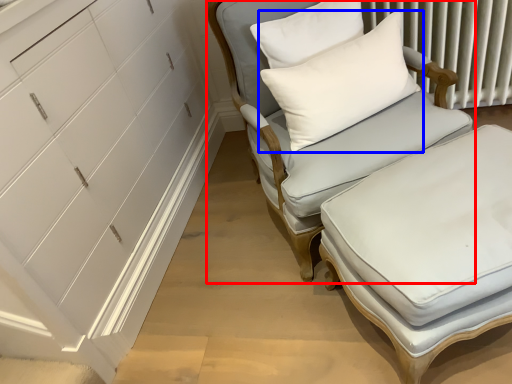
Question: Which of the following is the closest to the observer, chair (highlighted by a red box) or pillow (highlighted by a blue box)?

Choices:
 (A) chair
 (B) pillow

Answer: (A)